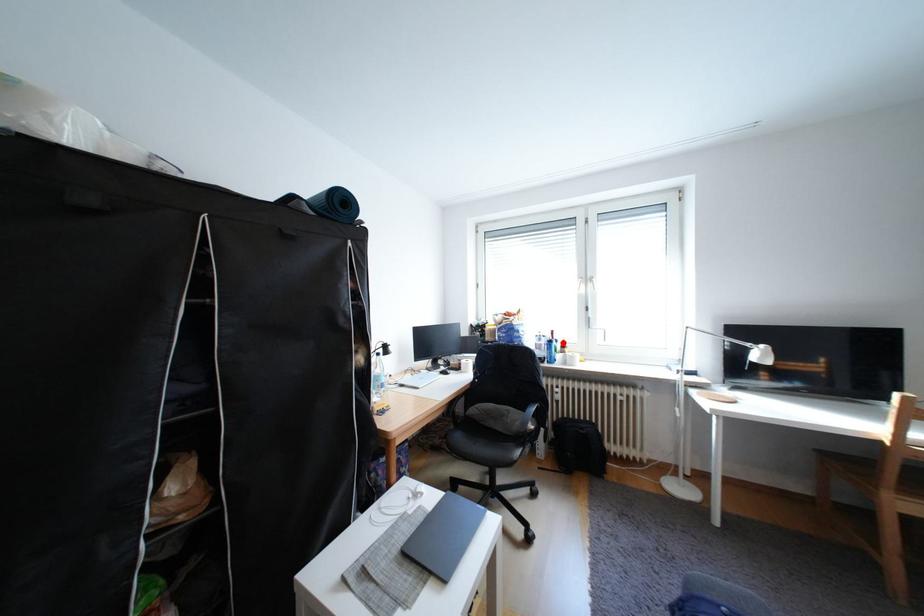
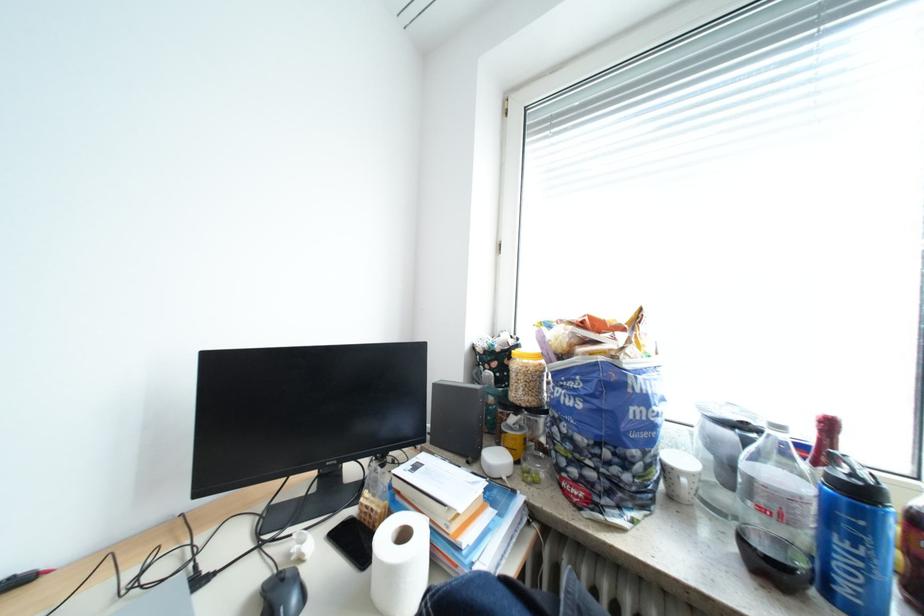
Where in the second image is the point corresponding to the highlighted location from the first image?

(873, 493)